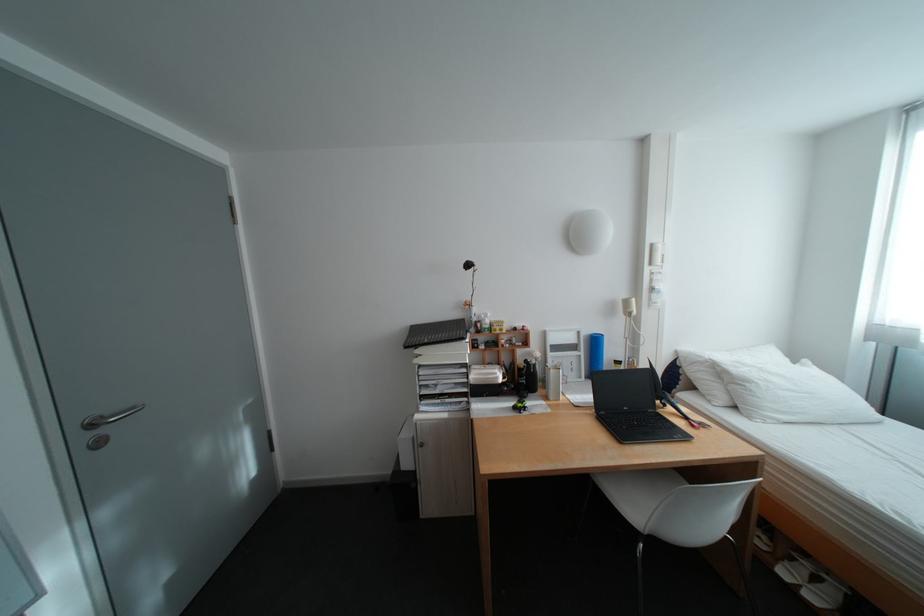
This screenshot has width=924, height=616. In order to click on white pillow in this screenshot , I will do `click(792, 392)`.